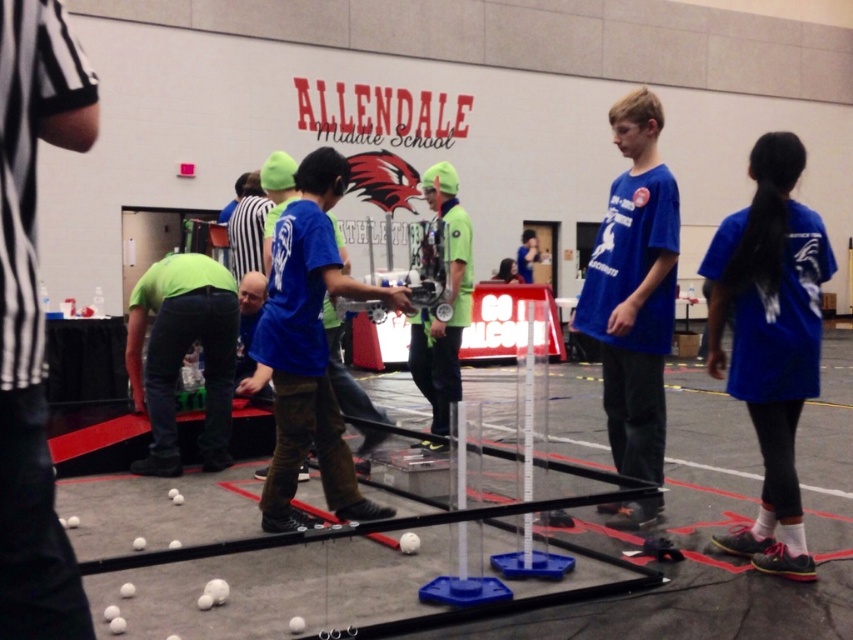
Question: Which point is farther to the camera?

Choices:
 (A) (221, 420)
 (B) (281, 406)

Answer: (A)

Question: Which point is closer to the camera?

Choices:
 (A) (26, 532)
 (B) (190, 301)

Answer: (A)

Question: Considering the real-world distances, which object is closest to the green fabric referee at center?

Choices:
 (A) blue fabric shirt at center
 (B) black and white striped shirt at upper left
 (C) blue matte shirt at center
 (D) blue cotton shirt at center

Answer: (C)

Question: Considering the relative positions of black and white striped shirt at upper left and green fabric referee at center in the image provided, where is black and white striped shirt at upper left located with respect to green fabric referee at center?

Choices:
 (A) below
 (B) above

Answer: (B)

Question: Does blue fabric shirt at center have a larger size compared to green fabric referee at center?

Choices:
 (A) no
 (B) yes

Answer: (A)

Question: Can you confirm if black and white striped shirt at upper left is positioned to the right of blue cotton shirt at center?

Choices:
 (A) no
 (B) yes

Answer: (A)